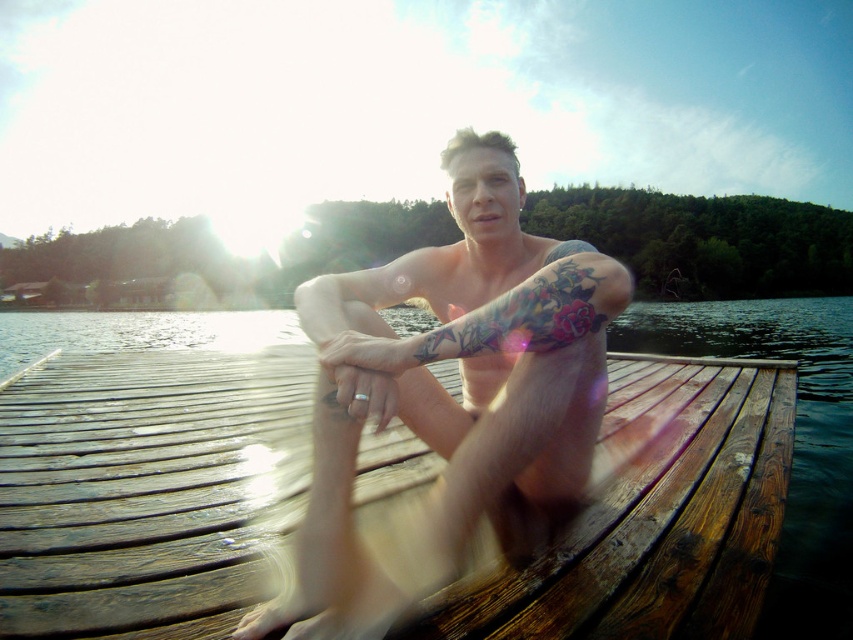
Is brown wooden dock at center further to camera compared to smooth skin man at center?

That is True.

Who is higher up, brown wooden dock at center or smooth skin man at center?

Positioned higher is smooth skin man at center.

Image resolution: width=853 pixels, height=640 pixels. Find the location of `brown wooden dock at center`. brown wooden dock at center is located at coordinates (132, 490).